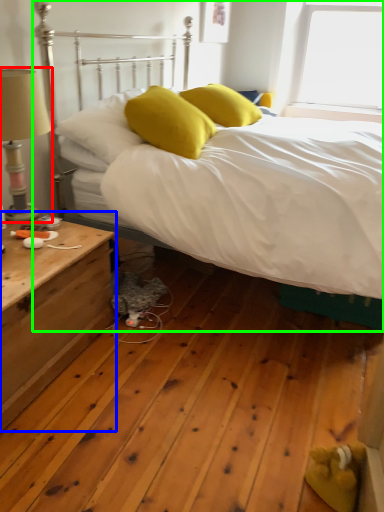
Question: Based on their relative distances, which object is nearer to table lamp (highlighted by a red box)? Choose from nightstand (highlighted by a blue box) and bed (highlighted by a green box).

Choices:
 (A) nightstand
 (B) bed

Answer: (B)